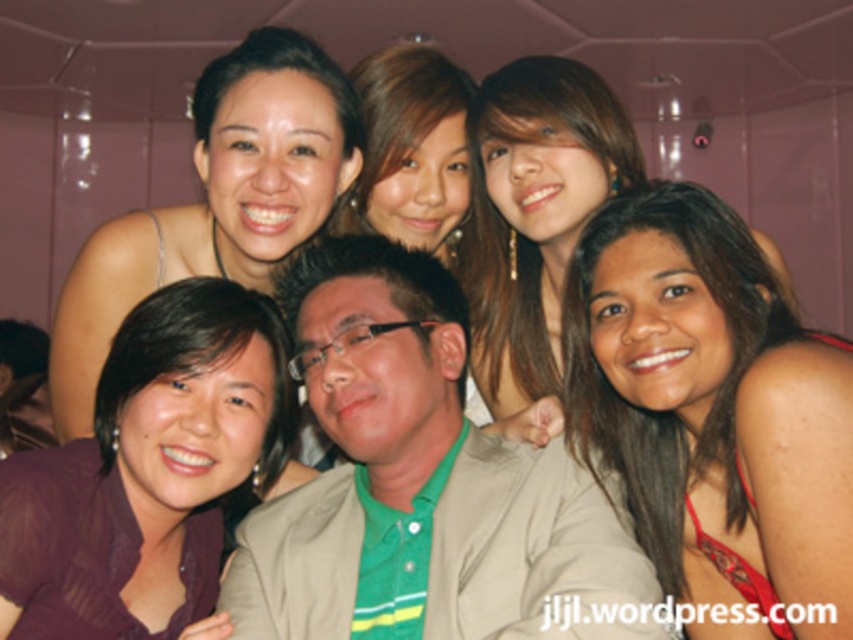
You are standing at the camera position and want to take a photo of the group. There is a small child who is 1.2 meters tall and wants to join the group. If the child stands at point (672, 548), will they be in the frame?

The distance between point (672, 548) and the camera is 1.43 meters. Since the child is 1.2 meters tall, they will be shorter than the distance to the point, so they will be in the frame.

You are a photographer trying to adjust the lighting for a group photo. You notice two elements in the image that might cast shadows. The brown hair at lower right and the green fabric shirt at center. Which of these two elements is smaller in size and might cast a less prominent shadow?

The brown hair at lower right has a smaller size compared to the green fabric shirt at center, so it might cast a less prominent shadow.

You are a photographer who wants to ensure that the brown hair at lower right and the purple satin blouse at lower left are clearly visible in the photo. Given their current distance, can you confirm if they are within a 30 inch frame?

The brown hair at lower right and purple satin blouse at lower left are 25.05 inches apart, so they are within the 30 inch frame and will be clearly visible.